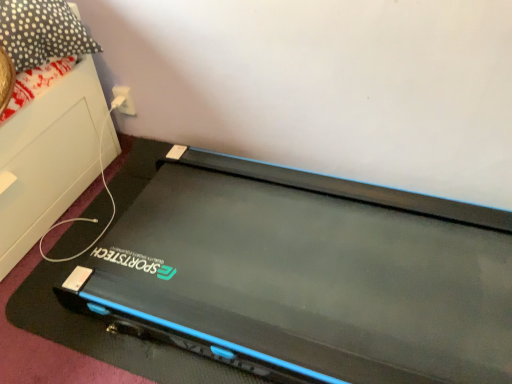
Question: Is polka dot fabric pillow at upper left at the right side of white plastic at upper center?

Choices:
 (A) yes
 (B) no

Answer: (B)

Question: Is polka dot fabric pillow at upper left completely or partially outside of white plastic at upper center?

Choices:
 (A) yes
 (B) no

Answer: (A)

Question: Can you confirm if polka dot fabric pillow at upper left is smaller than white plastic at upper center?

Choices:
 (A) yes
 (B) no

Answer: (B)

Question: From a real-world perspective, does polka dot fabric pillow at upper left stand above white plastic at upper center?

Choices:
 (A) no
 (B) yes

Answer: (B)

Question: Is polka dot fabric pillow at upper left to the left of white plastic at upper center from the viewer's perspective?

Choices:
 (A) no
 (B) yes

Answer: (B)

Question: From a real-world perspective, is black matte treadmill at center positioned above or below white plastic at upper center?

Choices:
 (A) below
 (B) above

Answer: (B)

Question: Is black matte treadmill at center in front of or behind white plastic at upper center in the image?

Choices:
 (A) behind
 (B) front

Answer: (B)

Question: Based on their sizes in the image, would you say black matte treadmill at center is bigger or smaller than white plastic at upper center?

Choices:
 (A) big
 (B) small

Answer: (A)

Question: Considering the positions of black matte treadmill at center and white plastic at upper center in the image, is black matte treadmill at center wider or thinner than white plastic at upper center?

Choices:
 (A) wide
 (B) thin

Answer: (A)

Question: Is white plastic at upper center wider or thinner than polka dot fabric pillow at upper left?

Choices:
 (A) thin
 (B) wide

Answer: (A)

Question: From a real-world perspective, is white plastic at upper center above or below polka dot fabric pillow at upper left?

Choices:
 (A) below
 (B) above

Answer: (A)

Question: Considering their positions, is white plastic at upper center located in front of or behind polka dot fabric pillow at upper left?

Choices:
 (A) front
 (B) behind

Answer: (B)

Question: Does point (118, 94) appear closer or farther from the camera than point (15, 26)?

Choices:
 (A) closer
 (B) farther

Answer: (B)

Question: In terms of width, does polka dot fabric pillow at upper left look wider or thinner when compared to black matte treadmill at center?

Choices:
 (A) thin
 (B) wide

Answer: (A)

Question: From the image's perspective, relative to black matte treadmill at center, is polka dot fabric pillow at upper left above or below?

Choices:
 (A) above
 (B) below

Answer: (A)